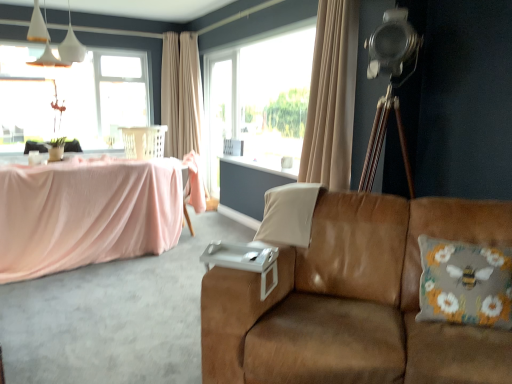
Question: From the image's perspective, does white matte pendant lights at upper left appear lower than transparent glass screen door at center?

Choices:
 (A) no
 (B) yes

Answer: (A)

Question: From a real-world perspective, is white matte pendant lights at upper left under transparent glass screen door at center?

Choices:
 (A) yes
 (B) no

Answer: (B)

Question: Can you confirm if white matte pendant lights at upper left is positioned to the left of transparent glass screen door at center?

Choices:
 (A) yes
 (B) no

Answer: (A)

Question: Is white matte pendant lights at upper left looking in the opposite direction of transparent glass screen door at center?

Choices:
 (A) yes
 (B) no

Answer: (B)

Question: Does white matte pendant lights at upper left have a lesser height compared to transparent glass screen door at center?

Choices:
 (A) yes
 (B) no

Answer: (A)

Question: Does white matte pendant lights at upper left have a greater width compared to transparent glass screen door at center?

Choices:
 (A) no
 (B) yes

Answer: (B)

Question: Is brown suede couch at center outside beige fabric curtain at upper center, the 1th curtain viewed from the front?

Choices:
 (A) yes
 (B) no

Answer: (A)

Question: Considering the relative positions of brown suede couch at center and beige fabric curtain at upper center, which is counted as the first curtain, starting from the right, in the image provided, is brown suede couch at center in front of beige fabric curtain at upper center, which is counted as the first curtain, starting from the right,?

Choices:
 (A) no
 (B) yes

Answer: (B)

Question: Does brown suede couch at center have a smaller size compared to beige fabric curtain at upper center, arranged as the second curtain when viewed from the left?

Choices:
 (A) no
 (B) yes

Answer: (A)

Question: From a real-world perspective, is brown suede couch at center located beneath beige fabric curtain at upper center, the 1th curtain viewed from the front?

Choices:
 (A) no
 (B) yes

Answer: (B)

Question: From a real-world perspective, is brown suede couch at center positioned over beige fabric curtain at upper center, arranged as the second curtain when viewed from the left, based on gravity?

Choices:
 (A) yes
 (B) no

Answer: (B)

Question: Can beige fabric curtain at upper center, which is counted as the first curtain, starting from the right, be found inside brown suede couch at center?

Choices:
 (A) no
 (B) yes

Answer: (A)

Question: Is transparent glass window at upper left not close to floral-patterned fabric pillow at right, the 1th pillow in the front-to-back sequence?

Choices:
 (A) yes
 (B) no

Answer: (A)